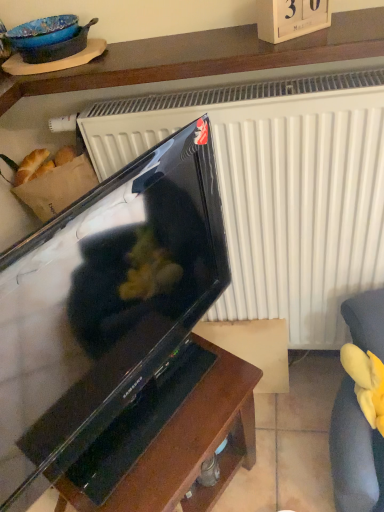
The image size is (384, 512). Identify the location of free location above brown wood table at center (from a real-world perspective). (161, 417).